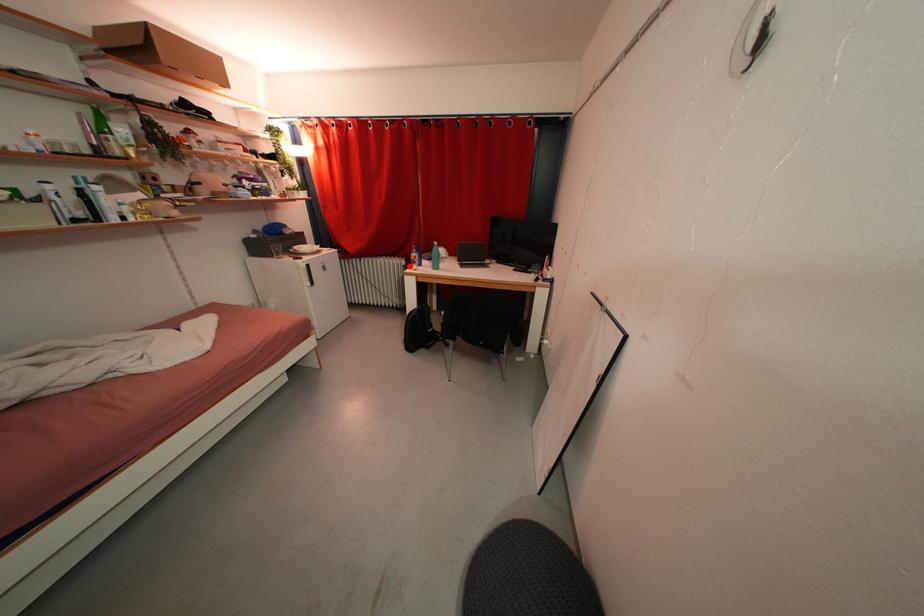
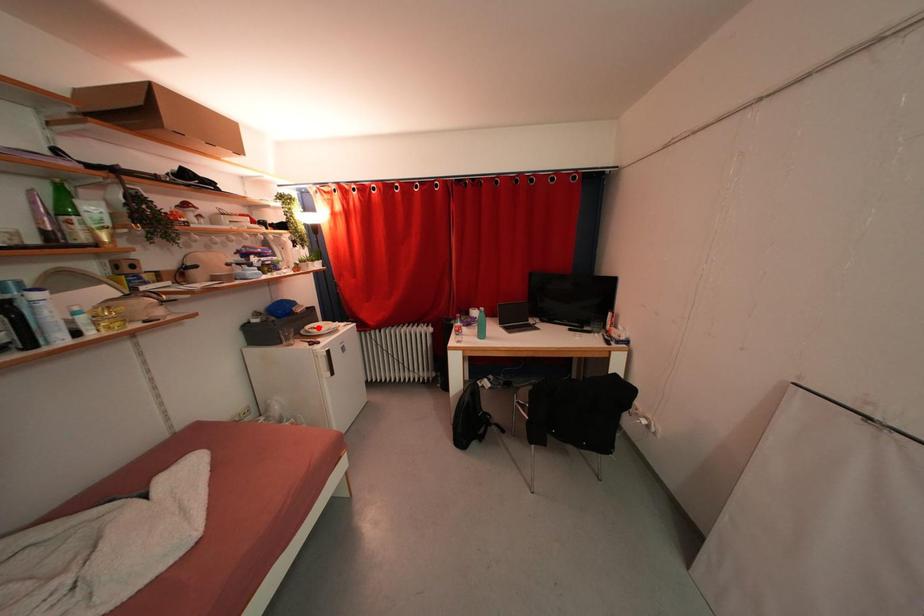
In the scene shown: I am providing you with two images of the same scene from different viewpoints. A red point is marked on the first image and another point is marked on the second image. Are the points marked in image1 and image2 representing the same 3D position?

No